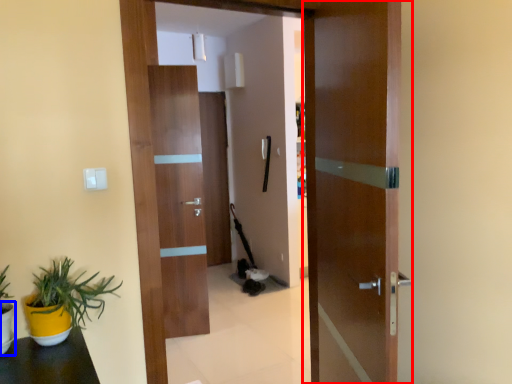
Question: Which object is further to the camera taking this photo, door (highlighted by a red box) or flowerpot (highlighted by a blue box)?

Choices:
 (A) door
 (B) flowerpot

Answer: (B)